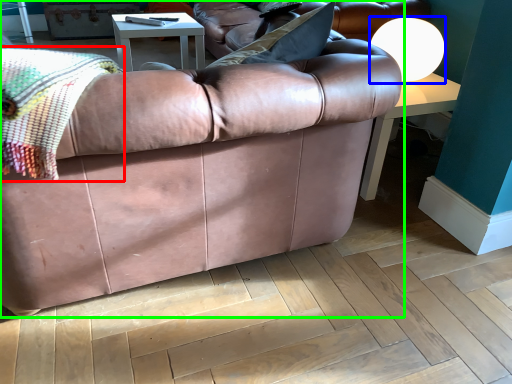
Question: Considering the real-world distances, which object is farthest from blanket (highlighted by a red box)? lamp (highlighted by a blue box) or studio couch (highlighted by a green box)?

Choices:
 (A) lamp
 (B) studio couch

Answer: (A)